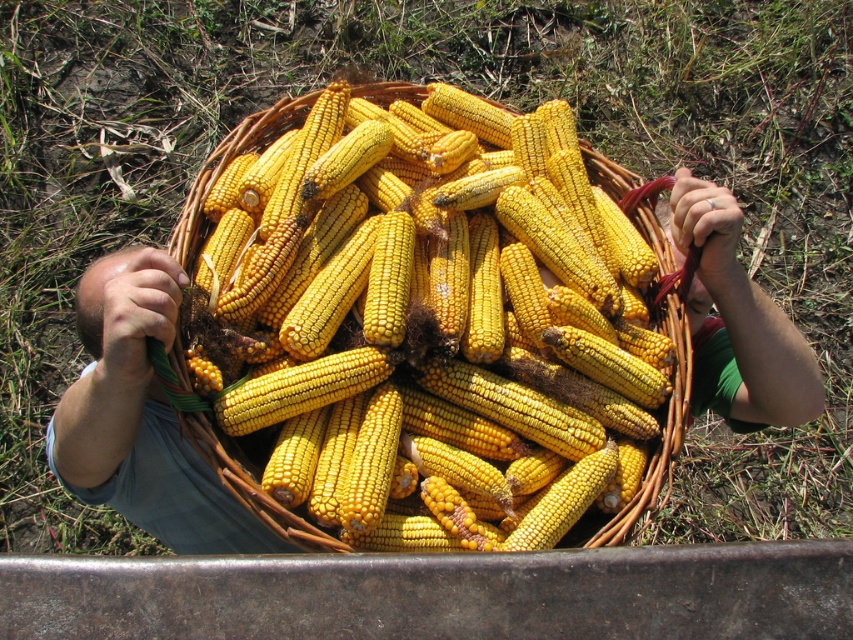
Is woven brown basket at center smaller than green fabric hand at upper center?

No.

Is woven brown basket at center to the left of green fabric hand at upper center from the viewer's perspective?

Correct, you'll find woven brown basket at center to the left of green fabric hand at upper center.

Find the location of `woven brown basket at center`. woven brown basket at center is located at coordinates (447, 330).